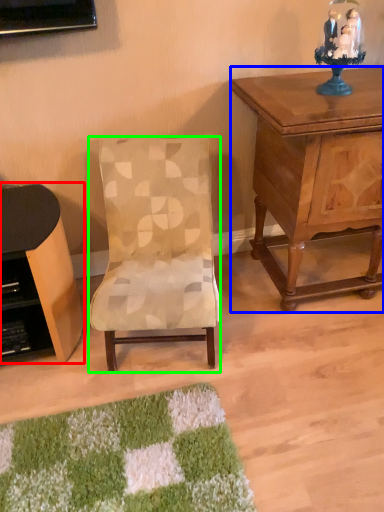
Question: Which is farther away from desk (highlighted by a red box)? nightstand (highlighted by a blue box) or chair (highlighted by a green box)?

Choices:
 (A) nightstand
 (B) chair

Answer: (A)